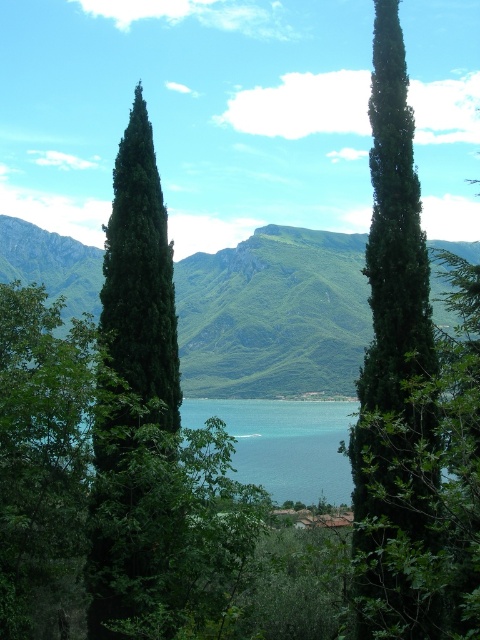
Is green leafy mountain at center smaller than green matte tree at center?

No, green leafy mountain at center is not smaller than green matte tree at center.

Which is above, green leafy mountain at center or green matte tree at center?

Positioned higher is green leafy mountain at center.

Locate an element on the screen. green leafy mountain at center is located at coordinates (274, 314).

Does green glossy cypress at center appear on the left side of green matte tree at center?

Incorrect, green glossy cypress at center is not on the left side of green matte tree at center.

Which is more to the left, green glossy cypress at center or green matte tree at center?

Positioned to the left is green matte tree at center.

Between point (363, 417) and point (146, 269), which one is positioned behind?

The point (146, 269) is behind.

The height and width of the screenshot is (640, 480). What are the coordinates of `green glossy cypress at center` in the screenshot? It's located at (394, 362).

This screenshot has height=640, width=480. Describe the element at coordinates (274, 314) in the screenshot. I see `green leafy mountain at center` at that location.

Which of these two, green leafy mountain at center or green glossy cypress at center, stands taller?

green leafy mountain at center is taller.

The image size is (480, 640). Find the location of `green leafy mountain at center`. green leafy mountain at center is located at coordinates (274, 314).